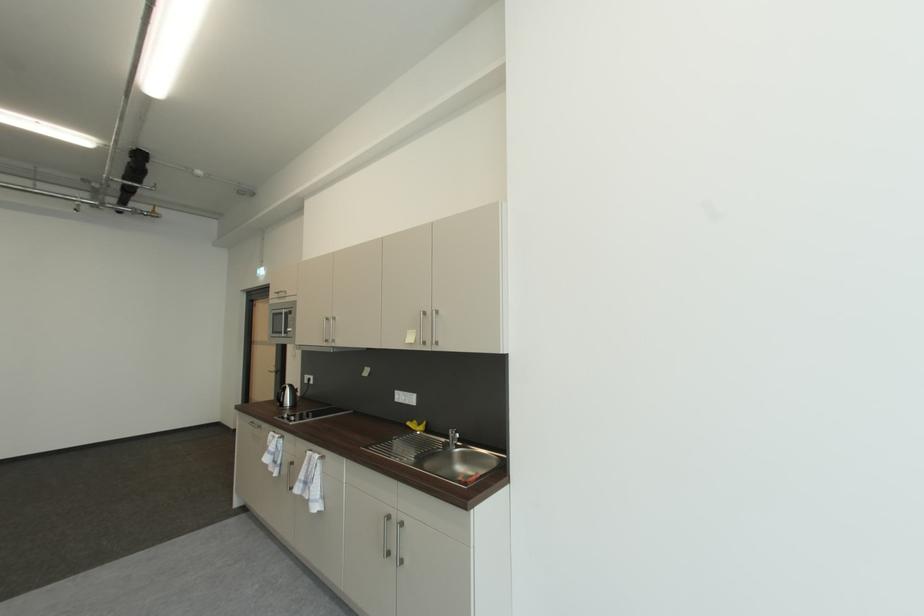
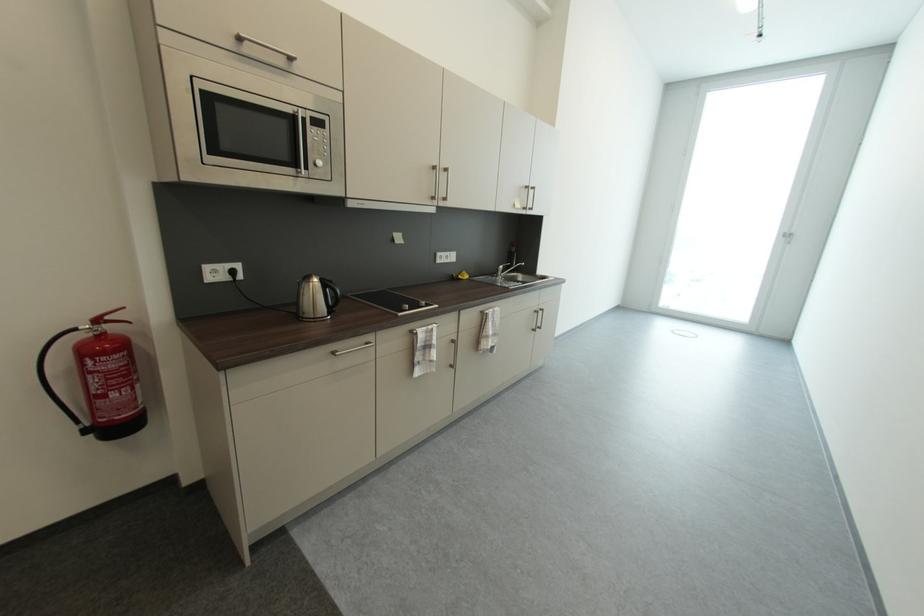
Find the pixel in the second image that matches pixel 395 517 in the first image.

(541, 313)